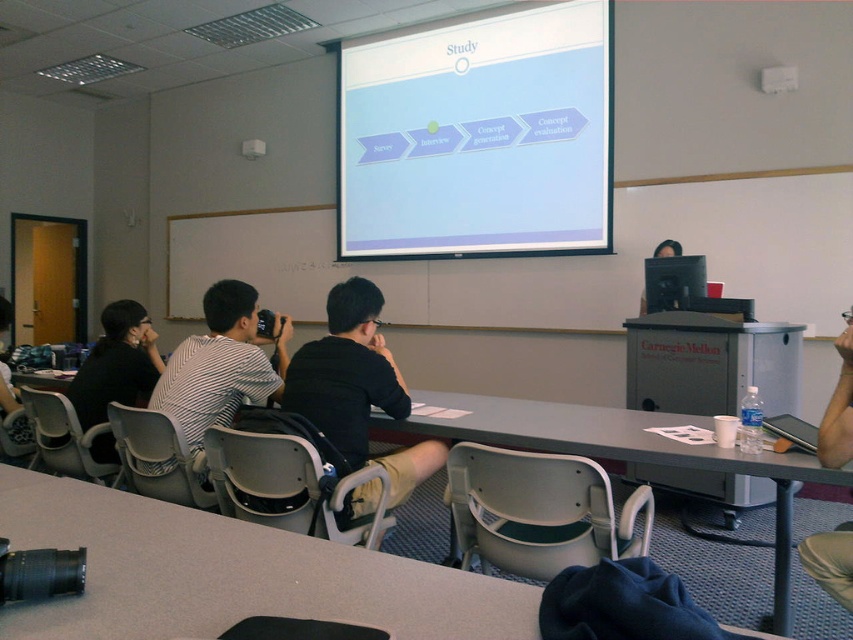
Between striped fabric shirt at center and black striped shirt at left, which one appears on the right side from the viewer's perspective?

striped fabric shirt at center

Which is below, striped fabric shirt at center or black striped shirt at left?

black striped shirt at left is lower down.

Who is more forward, (225, 378) or (109, 381)?

Positioned in front is point (225, 378).

The width and height of the screenshot is (853, 640). Find the location of `striped fabric shirt at center`. striped fabric shirt at center is located at coordinates (221, 364).

Can you confirm if white glossy projector screen at upper center is positioned below matte black monitor at upper right?

Actually, white glossy projector screen at upper center is above matte black monitor at upper right.

Can you confirm if white glossy projector screen at upper center is taller than matte black monitor at upper right?

Indeed, white glossy projector screen at upper center has a greater height compared to matte black monitor at upper right.

The width and height of the screenshot is (853, 640). Find the location of `white glossy projector screen at upper center`. white glossy projector screen at upper center is located at coordinates (479, 138).

Which is above, smooth gray table at center or matte black monitor at upper right?

Positioned higher is matte black monitor at upper right.

Does smooth gray table at center appear on the left side of matte black monitor at upper right?

Indeed, smooth gray table at center is positioned on the left side of matte black monitor at upper right.

Image resolution: width=853 pixels, height=640 pixels. What do you see at coordinates (231, 573) in the screenshot? I see `smooth gray table at center` at bounding box center [231, 573].

Find the location of a particular element. The width and height of the screenshot is (853, 640). smooth gray table at center is located at coordinates (231, 573).